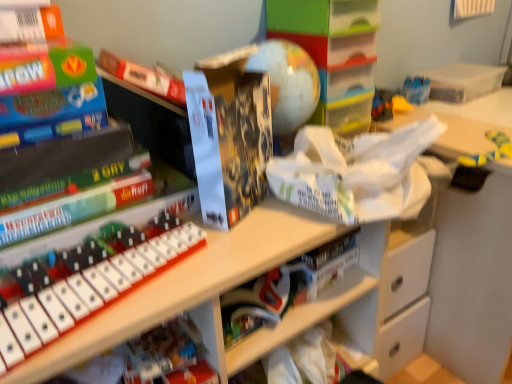
Question: Visually, is white matte keyboard at center, which is the first shelf from bottom to top, positioned to the left or to the right of matte black lego box at center?

Choices:
 (A) right
 (B) left

Answer: (B)

Question: Is white matte keyboard at center, which is the first shelf from bottom to top, inside the boundaries of matte black lego box at center, or outside?

Choices:
 (A) inside
 (B) outside

Answer: (B)

Question: Which object is positioned farthest from the white plastic musical keyboard at center?

Choices:
 (A) white matte keyboard at center, which is the first shelf from bottom to top
 (B) matte plastic globe at center, positioned as the second shelf in bottom-to-top order
 (C) clear plastic box at upper right
 (D) matte black lego box at center
 (E) white matte book at center

Answer: (C)

Question: Which of these objects is positioned closest to the white matte book at center?

Choices:
 (A) white plastic musical keyboard at center
 (B) matte plastic globe at center, placed as the first shelf when sorted from top to bottom
 (C) yellow rubber boot at right
 (D) clear plastic box at upper right
 (E) matte black lego box at center

Answer: (E)